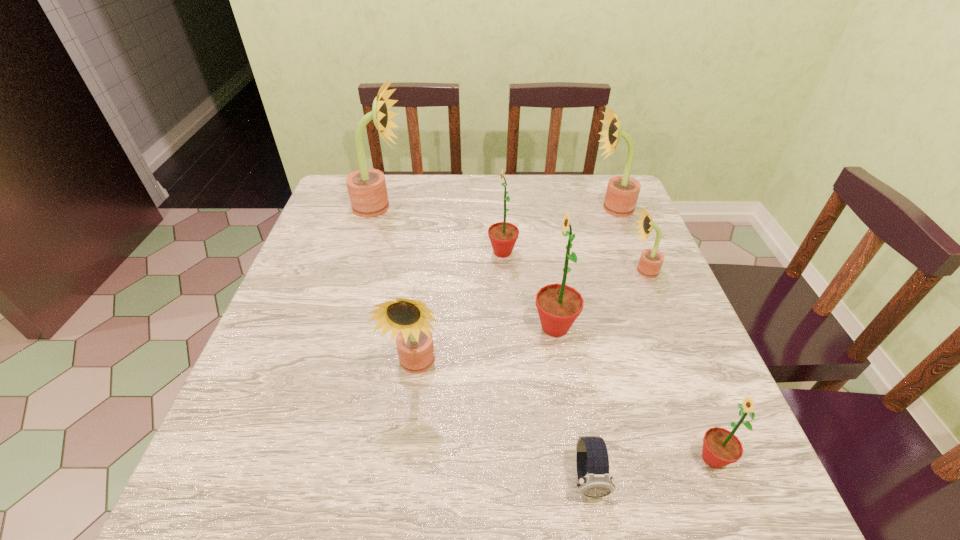
This screenshot has height=540, width=960. Find the location of `unoccupied area between the second biggest yellow sunflower and the smallest green sunflower`. unoccupied area between the second biggest yellow sunflower and the smallest green sunflower is located at coordinates (662, 333).

I want to click on free space between the second object from left to right and the watch, so click(x=502, y=422).

Select which object is the sixth closest to the third smallest yellow sunflower. Please provide its 2D coordinates. Your answer should be formatted as a tuple, i.e. [(x, y)], where the tuple contains the x and y coordinates of a point satisfying the conditions above.

[(721, 447)]

The width and height of the screenshot is (960, 540). Identify the location of object that is the third closest one to the smallest yellow sunflower. pos(503,235).

Image resolution: width=960 pixels, height=540 pixels. Find the location of `sunflower that is the fifth closest to the third smallest yellow sunflower`. sunflower that is the fifth closest to the third smallest yellow sunflower is located at coordinates (407, 319).

Locate which sunflower is the second closest to the sixth object from right to left. Please provide its 2D coordinates. Your answer should be formatted as a tuple, i.e. [(x, y)], where the tuple contains the x and y coordinates of a point satisfying the conditions above.

[(622, 192)]

Point out which yellow sunflower is positioned as the second nearest to the tallest object. Please provide its 2D coordinates. Your answer should be formatted as a tuple, i.e. [(x, y)], where the tuple contains the x and y coordinates of a point satisfying the conditions above.

[(622, 192)]

Identify which yellow sunflower is located as the nearest to the second nearest yellow sunflower. Please provide its 2D coordinates. Your answer should be formatted as a tuple, i.e. [(x, y)], where the tuple contains the x and y coordinates of a point satisfying the conditions above.

[(622, 192)]

Identify which green sunflower is the nearest to the rightmost green sunflower. Please provide its 2D coordinates. Your answer should be formatted as a tuple, i.e. [(x, y)], where the tuple contains the x and y coordinates of a point satisfying the conditions above.

[(558, 305)]

Select which green sunflower appears as the third closest to the second biggest yellow sunflower. Please provide its 2D coordinates. Your answer should be formatted as a tuple, i.e. [(x, y)], where the tuple contains the x and y coordinates of a point satisfying the conditions above.

[(721, 447)]